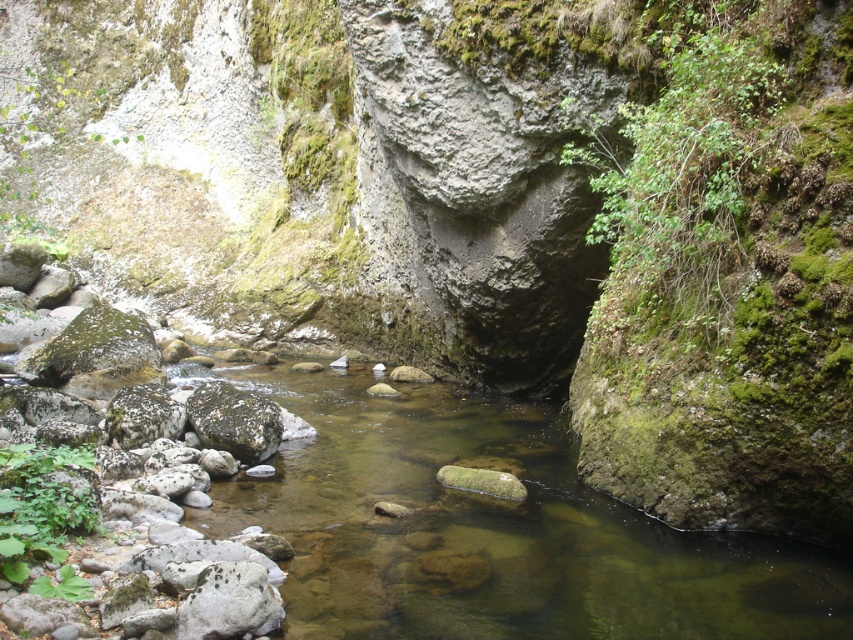
Question: Can you confirm if clear water stream at center is wider than green mossy rock at center?

Choices:
 (A) yes
 (B) no

Answer: (A)

Question: From the image, what is the correct spatial relationship of clear water stream at center in relation to green mossy rock at center?

Choices:
 (A) left
 (B) right

Answer: (B)

Question: Can you confirm if clear water stream at center is bigger than green mossy rock at center?

Choices:
 (A) yes
 (B) no

Answer: (A)

Question: Which point appears farthest from the camera in this image?

Choices:
 (A) (402, 422)
 (B) (207, 381)

Answer: (B)

Question: Which point appears closest to the camera in this image?

Choices:
 (A) (567, 440)
 (B) (254, 435)

Answer: (B)